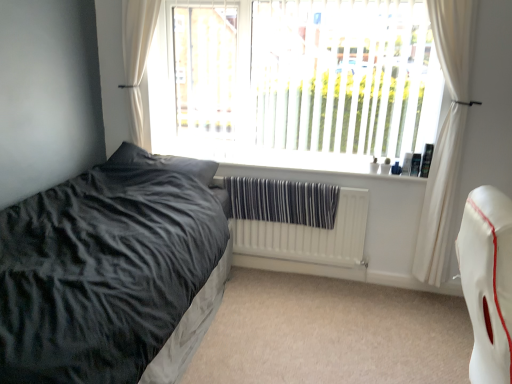
Question: Does white fabric curtain at upper left, the second curtain viewed from the right, have a smaller size compared to dark grey plush pillow at left?

Choices:
 (A) yes
 (B) no

Answer: (A)

Question: Can you confirm if white fabric curtain at upper left, the second curtain viewed from the right, is thinner than dark grey plush pillow at left?

Choices:
 (A) yes
 (B) no

Answer: (A)

Question: Is white fabric curtain at upper left, the 1th curtain when ordered from left to right, oriented towards dark grey plush pillow at left?

Choices:
 (A) no
 (B) yes

Answer: (A)

Question: Does white fabric curtain at upper left, the second curtain viewed from the right, have a lesser height compared to dark grey plush pillow at left?

Choices:
 (A) yes
 (B) no

Answer: (B)

Question: Considering the relative positions of white fabric curtain at upper left, the second curtain viewed from the right, and dark grey plush pillow at left in the image provided, is white fabric curtain at upper left, the second curtain viewed from the right, behind dark grey plush pillow at left?

Choices:
 (A) no
 (B) yes

Answer: (B)

Question: Is point click(x=466, y=76) positioned closer to the camera than point click(x=247, y=243)?

Choices:
 (A) closer
 (B) farther

Answer: (A)

Question: Is white sheer curtain at right, which ranks as the second curtain in left-to-right order, wider or thinner than white textured radiator at center?

Choices:
 (A) wide
 (B) thin

Answer: (A)

Question: Considering the positions of white sheer curtain at right, which ranks as the second curtain in left-to-right order, and white textured radiator at center in the image, is white sheer curtain at right, which ranks as the second curtain in left-to-right order, taller or shorter than white textured radiator at center?

Choices:
 (A) short
 (B) tall

Answer: (B)

Question: Considering the relative positions of white sheer curtain at right, which ranks as the first curtain in right-to-left order, and white textured radiator at center in the image provided, is white sheer curtain at right, which ranks as the first curtain in right-to-left order, to the left or to the right of white textured radiator at center?

Choices:
 (A) left
 (B) right

Answer: (B)

Question: Based on their sizes in the image, would you say dark grey plush pillow at left is bigger or smaller than white textured radiator at center?

Choices:
 (A) big
 (B) small

Answer: (A)

Question: Looking at their shapes, would you say dark grey plush pillow at left is wider or thinner than white textured radiator at center?

Choices:
 (A) wide
 (B) thin

Answer: (A)

Question: From the image's perspective, is dark grey plush pillow at left positioned above or below white textured radiator at center?

Choices:
 (A) above
 (B) below

Answer: (A)

Question: From a real-world perspective, is dark grey plush pillow at left physically located above or below white textured radiator at center?

Choices:
 (A) above
 (B) below

Answer: (A)

Question: Based on their sizes in the image, would you say white leather swivel chair at right is bigger or smaller than dark grey plush pillow at left?

Choices:
 (A) small
 (B) big

Answer: (B)

Question: Considering the positions of white leather swivel chair at right and dark grey plush pillow at left in the image, is white leather swivel chair at right taller or shorter than dark grey plush pillow at left?

Choices:
 (A) short
 (B) tall

Answer: (B)